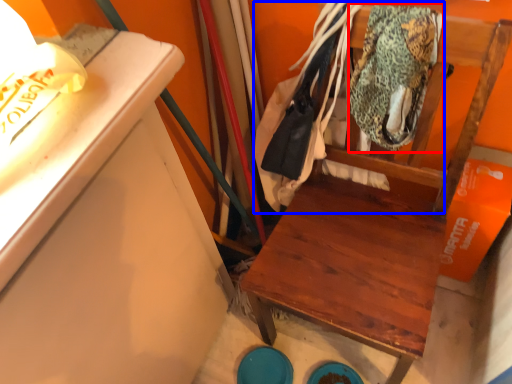
Question: Among these objects, which one is farthest to the camera, clothing (highlighted by a red box) or laundry (highlighted by a blue box)?

Choices:
 (A) clothing
 (B) laundry

Answer: (A)